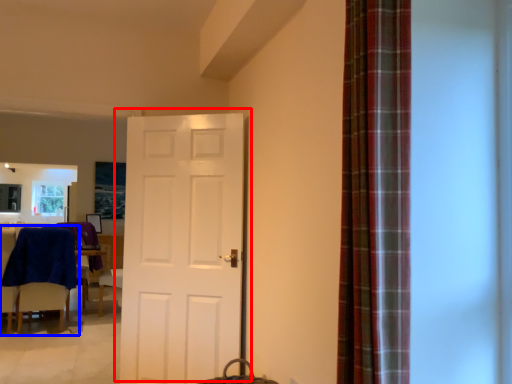
Question: Among these objects, which one is farthest to the camera, door (highlighted by a red box) or chair (highlighted by a blue box)?

Choices:
 (A) door
 (B) chair

Answer: (B)